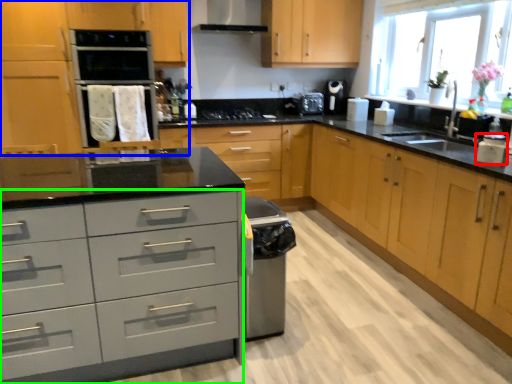
Question: Estimate the real-world distances between objects in this image. Which object is farther from kitchen appliance (highlighted by a red box), cabinetry (highlighted by a blue box) or drawer (highlighted by a green box)?

Choices:
 (A) cabinetry
 (B) drawer

Answer: (A)